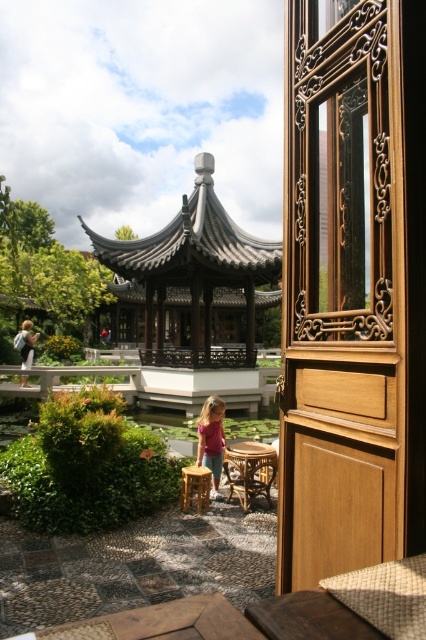
Is wooden carved door at right above rustic wood stool at center?

Yes.

What do you see at coordinates (342, 298) in the screenshot?
I see `wooden carved door at right` at bounding box center [342, 298].

The width and height of the screenshot is (426, 640). What are the coordinates of `wooden carved door at right` in the screenshot? It's located at [342, 298].

Does pink fabric dress at center appear over rustic wood stool at center?

Yes.

Who is more forward, [204,420] or [184,481]?

Point [184,481] is more forward.

Which is in front, point (204, 448) or point (198, 484)?

Positioned in front is point (198, 484).

Locate an element on the screen. pink fabric dress at center is located at coordinates (212, 440).

In order to click on green leafy bush at lower left in this screenshot , I will do `click(88, 465)`.

Does green leafy bush at lower left have a larger size compared to rustic wood stool at center?

Correct, green leafy bush at lower left is larger in size than rustic wood stool at center.

Which is behind, point (69, 506) or point (207, 474)?

Positioned behind is point (207, 474).

This screenshot has height=640, width=426. I want to click on green leafy bush at lower left, so click(x=88, y=465).